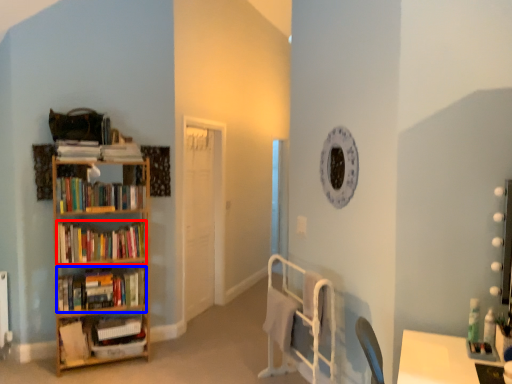
Question: Which point is closer to the camera, book (highlighted by a red box) or book (highlighted by a blue box)?

Choices:
 (A) book
 (B) book

Answer: (A)